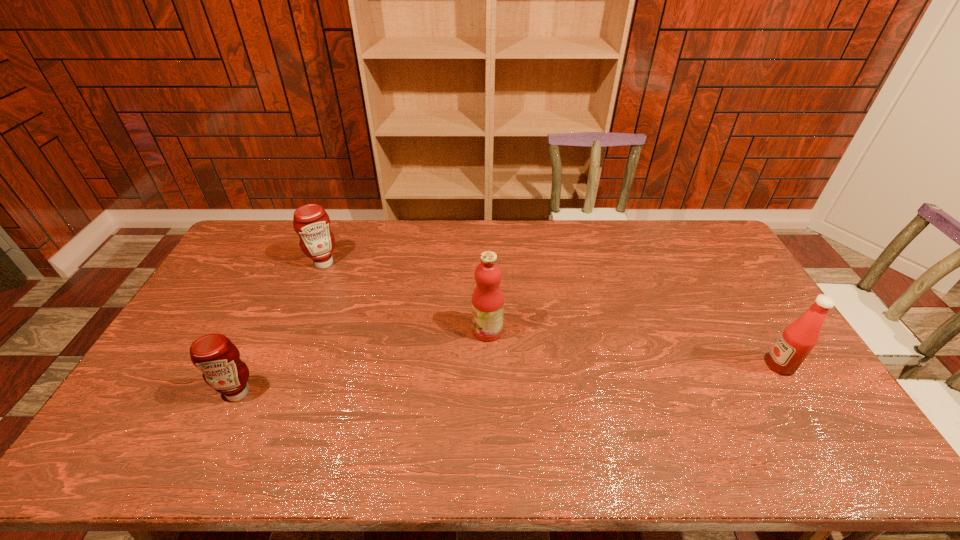
Find the location of `vacant area at the far left corner`. vacant area at the far left corner is located at coordinates (258, 245).

You are a GUI agent. You are given a task and a screenshot of the screen. Output one action in this format:
    pyautogui.click(x=<x>, y=<y>)
    Task: Click on the free space at the near left corner of the desktop
    The height and width of the screenshot is (540, 960).
    Given the screenshot: What is the action you would take?
    pyautogui.click(x=154, y=464)

Locate an element on the screen. This screenshot has height=540, width=960. free spot between the second nearest condiment and the nearest condiment is located at coordinates (509, 379).

Where is `vacant region between the fruit juice and the farthest object`? Image resolution: width=960 pixels, height=540 pixels. vacant region between the fruit juice and the farthest object is located at coordinates (406, 297).

The height and width of the screenshot is (540, 960). In order to click on free space between the nearest condiment and the second farthest object in this screenshot , I will do `click(363, 362)`.

You are a GUI agent. You are given a task and a screenshot of the screen. Output one action in this format:
    pyautogui.click(x=<x>, y=<y>)
    Task: Click on the vacant area that lies between the nearest condiment and the second nearest condiment
    The width and height of the screenshot is (960, 540).
    Given the screenshot: What is the action you would take?
    pyautogui.click(x=509, y=379)

I want to click on empty location between the farthest condiment and the second object from right to left, so click(406, 297).

What are the coordinates of `free spot between the farthest condiment and the rightmost object` in the screenshot? It's located at (552, 314).

Find the location of `blank region between the nearest object and the second object from right to left`. blank region between the nearest object and the second object from right to left is located at coordinates (363, 362).

Where is `free spot between the nearest condiment and the farthest object`? free spot between the nearest condiment and the farthest object is located at coordinates (281, 328).